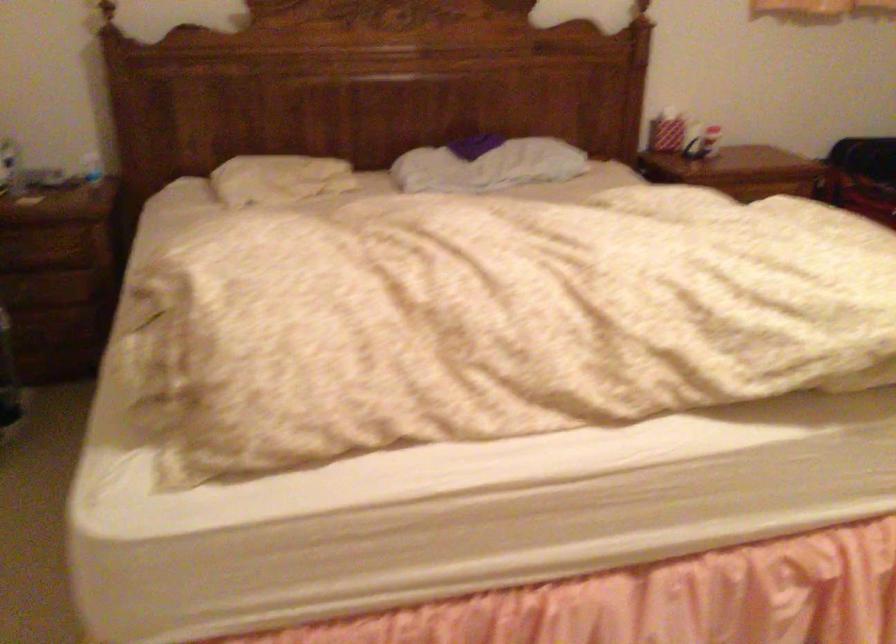
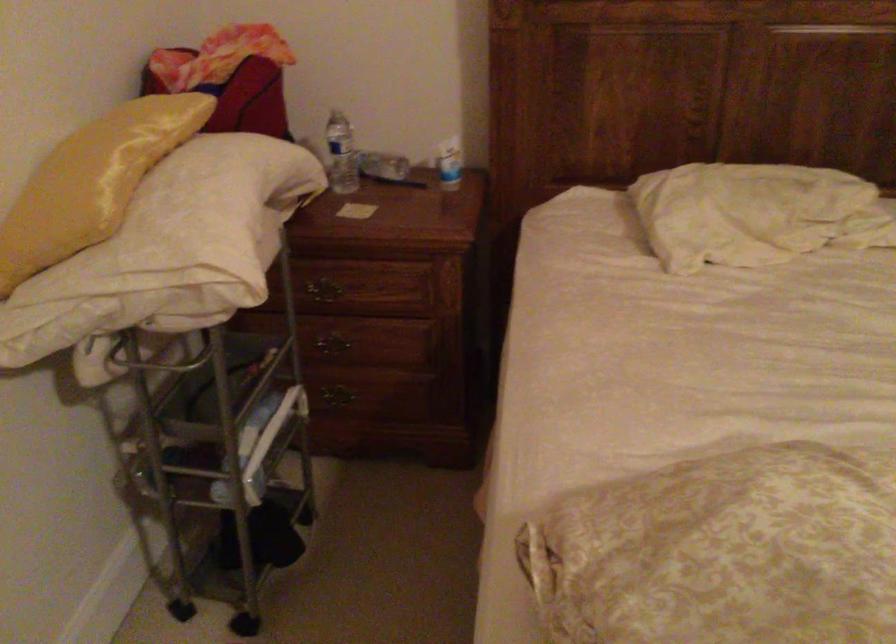
In a continuous first-person perspective shot, in which direction is the camera moving?

The cameraman moved toward left, forward.